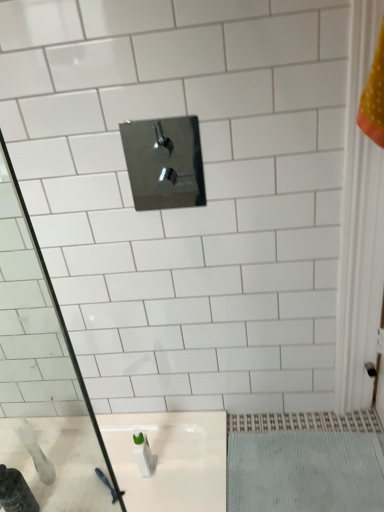
Question: Is point (168, 155) positioned closer to the camera than point (274, 477)?

Choices:
 (A) farther
 (B) closer

Answer: (A)

Question: From the image's perspective, is polished chrome tap at upper center positioned above or below white textured bath mat at lower right?

Choices:
 (A) above
 (B) below

Answer: (A)

Question: Which of these objects is positioned farthest from the polished chrome tap at upper center?

Choices:
 (A) white textured bath mat at lower right
 (B) white glossy bottle at lower left

Answer: (B)

Question: Which object is the farthest from the polished chrome tap at upper center?

Choices:
 (A) white glossy bottle at lower left
 (B) white textured bath mat at lower right

Answer: (A)